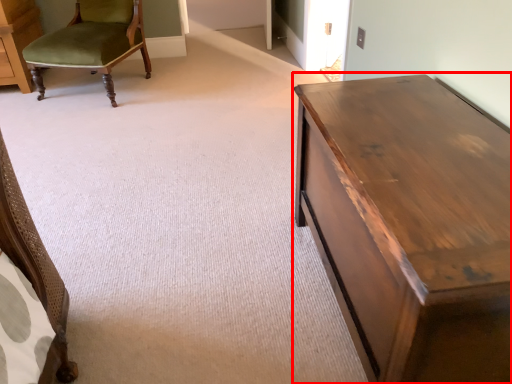
Question: From the image's perspective, where is table (annotated by the red box) located in relation to chair in the image?

Choices:
 (A) above
 (B) below

Answer: (B)